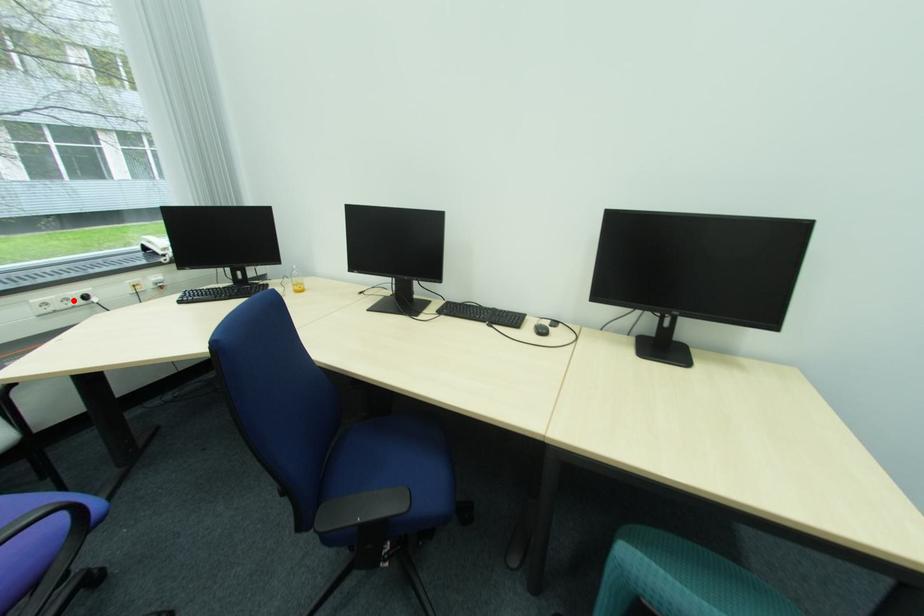
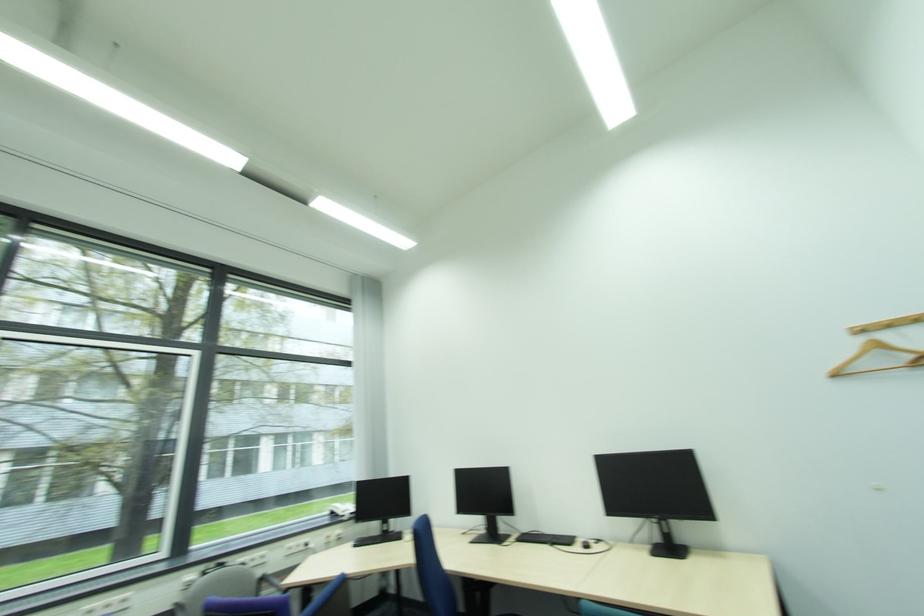
In the second image, find the point that corresponds to the highlighted location in the first image.

(305, 546)